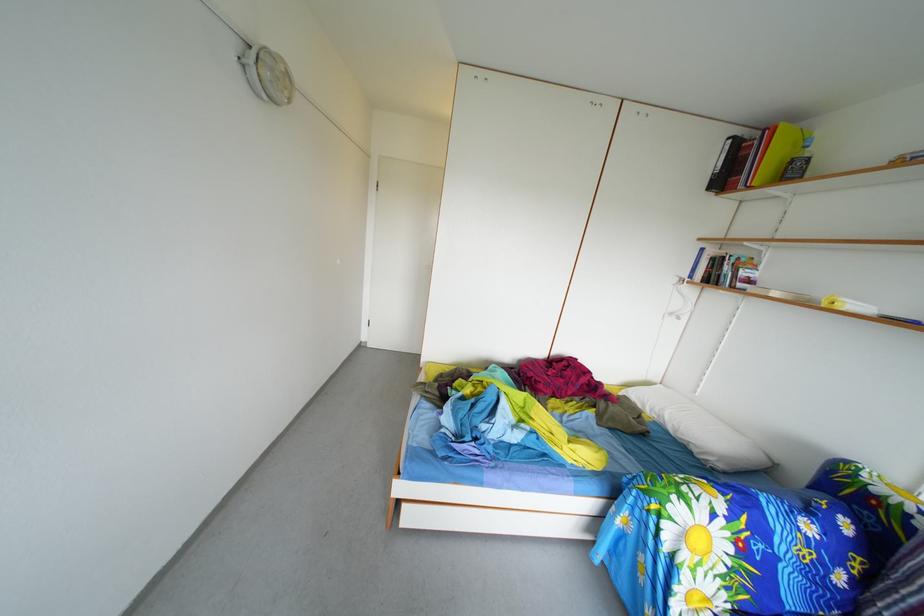
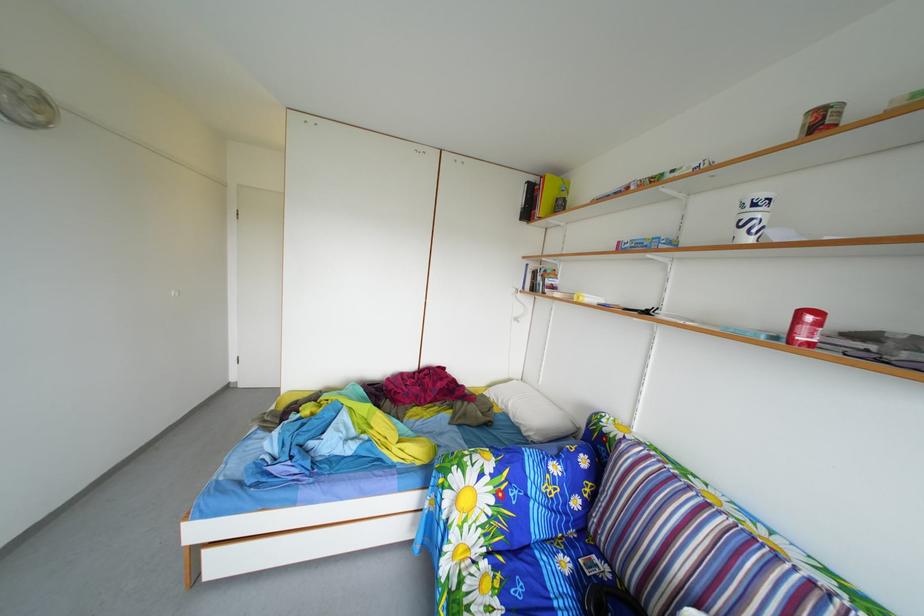
Question: I am providing you with two images of the same scene from different viewpoints. After the viewpoint changes to image2, which objects are now occluded?

Choices:
 (A) sofa armrest
 (B) red and white can
 (C) red plastic cup
 (D) none of these

Answer: (D)